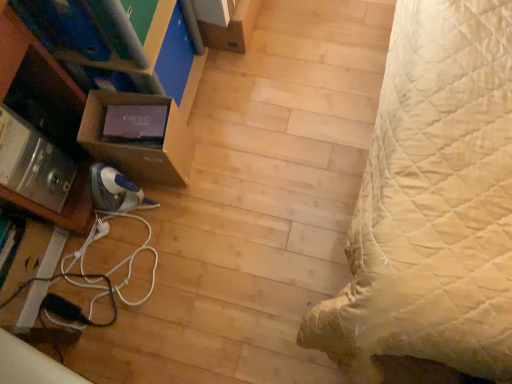
Question: Could you tell me if white cord at lower left is turned towards brown cardboard box at left, placed as the 1th shelf when sorted from right to left?

Choices:
 (A) yes
 (B) no

Answer: (B)

Question: Is white cord at lower left to the left of brown cardboard box at left, placed as the 1th shelf when sorted from right to left, from the viewer's perspective?

Choices:
 (A) no
 (B) yes

Answer: (B)

Question: Would you say white cord at lower left is a long distance from brown cardboard box at left, the 2th shelf positioned from the left?

Choices:
 (A) yes
 (B) no

Answer: (B)

Question: Does white cord at lower left lie behind brown cardboard box at left, placed as the 1th shelf when sorted from right to left?

Choices:
 (A) no
 (B) yes

Answer: (B)

Question: Does white cord at lower left have a smaller size compared to brown cardboard box at left, placed as the 1th shelf when sorted from right to left?

Choices:
 (A) yes
 (B) no

Answer: (A)

Question: Is white cord at lower left inside or outside of brown cardboard box at left, the 2th shelf positioned from the left?

Choices:
 (A) outside
 (B) inside

Answer: (A)

Question: From the image's perspective, is white cord at lower left located above or below brown cardboard box at left, placed as the 1th shelf when sorted from right to left?

Choices:
 (A) below
 (B) above

Answer: (A)

Question: Looking at their shapes, would you say white cord at lower left is wider or thinner than brown cardboard box at left, placed as the 1th shelf when sorted from right to left?

Choices:
 (A) wide
 (B) thin

Answer: (B)

Question: Is white cord at lower left taller or shorter than brown cardboard box at left, the 2th shelf positioned from the left?

Choices:
 (A) tall
 (B) short

Answer: (B)

Question: From a real-world perspective, is metallic silver shelf at lower left, marked as the 2th shelf in a right-to-left arrangement, physically located above or below brown cardboard box at left, placed as the 1th shelf when sorted from right to left?

Choices:
 (A) above
 (B) below

Answer: (A)

Question: From the image's perspective, is metallic silver shelf at lower left, marked as the 2th shelf in a right-to-left arrangement, located above or below brown cardboard box at left, the 2th shelf positioned from the left?

Choices:
 (A) above
 (B) below

Answer: (B)

Question: From their relative heights in the image, would you say metallic silver shelf at lower left, marked as the 2th shelf in a right-to-left arrangement, is taller or shorter than brown cardboard box at left, the 2th shelf positioned from the left?

Choices:
 (A) tall
 (B) short

Answer: (A)

Question: Considering their positions, is metallic silver shelf at lower left, marked as the 2th shelf in a right-to-left arrangement, located in front of or behind brown cardboard box at left, placed as the 1th shelf when sorted from right to left?

Choices:
 (A) front
 (B) behind

Answer: (A)

Question: Relative to brown cardboard box at left, the 2th shelf positioned from the left, is matte black monitor at left in front or behind?

Choices:
 (A) front
 (B) behind

Answer: (A)

Question: From a real-world perspective, relative to brown cardboard box at left, placed as the 1th shelf when sorted from right to left, is matte black monitor at left vertically above or below?

Choices:
 (A) above
 (B) below

Answer: (A)